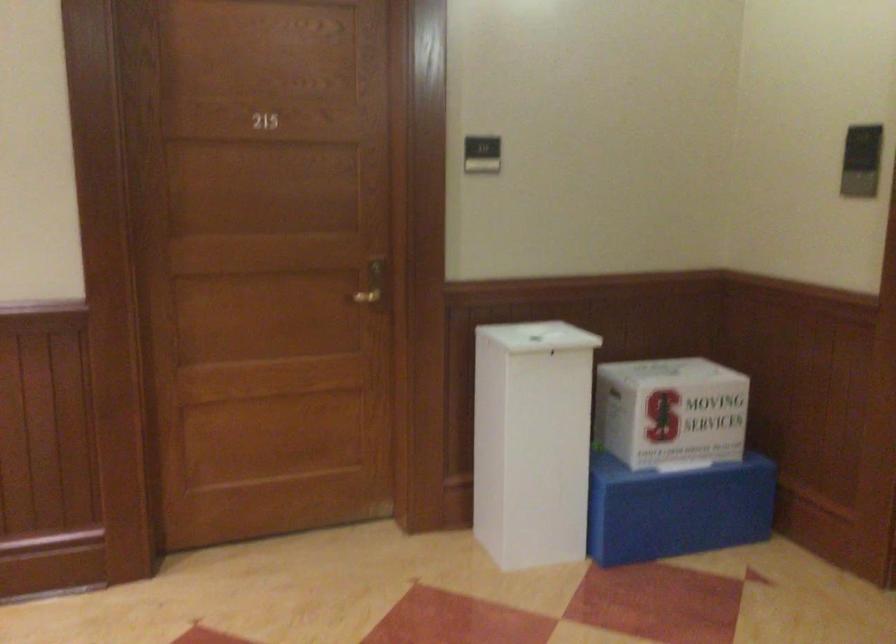
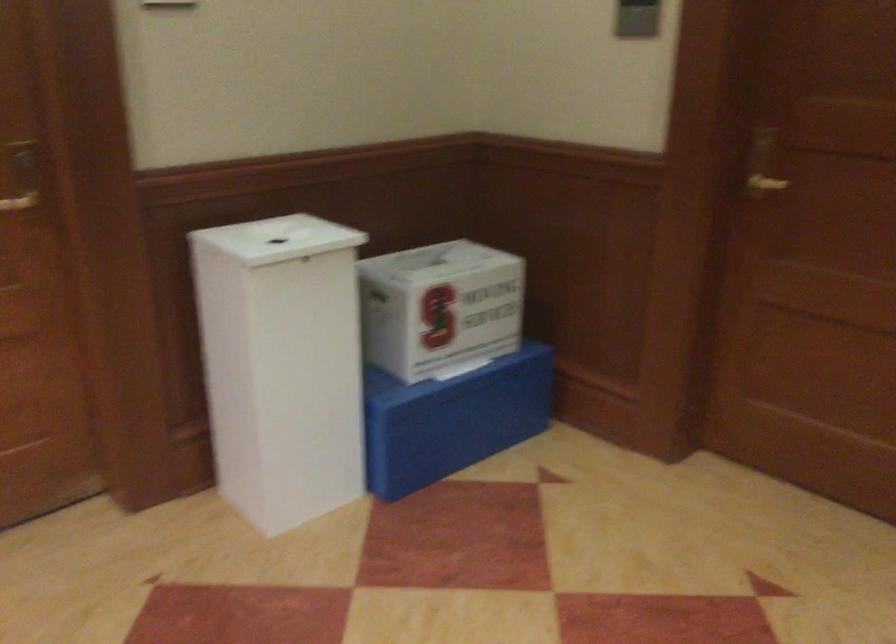
Where in the second image is the point corresponding to (369,281) from the first image?

(21, 176)